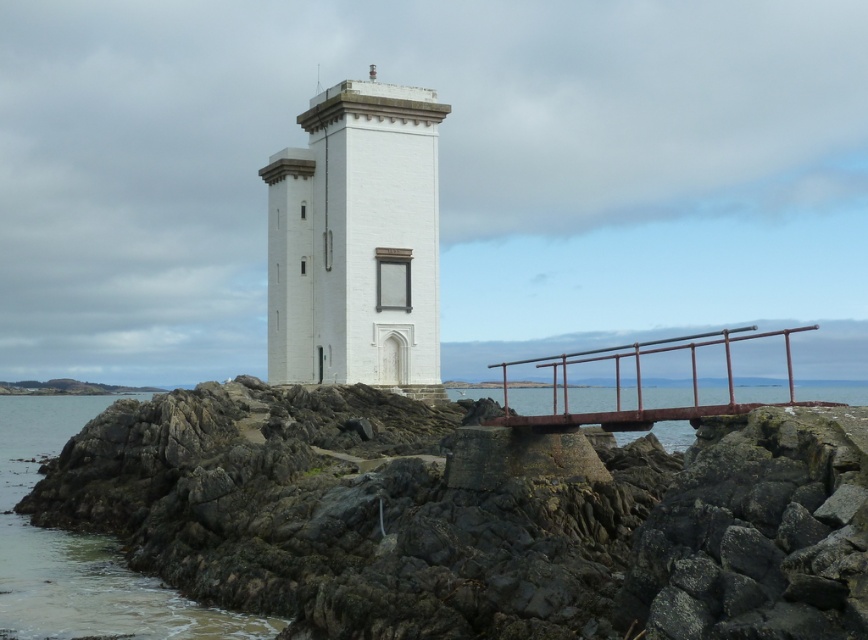
Question: Which point is closer to the camera?

Choices:
 (A) (117, 593)
 (B) (323, 136)

Answer: (A)

Question: Is white matte tower at center positioned in front of rusty metal railing at center?

Choices:
 (A) yes
 (B) no

Answer: (B)

Question: Among these objects, which one is farthest from the camera?

Choices:
 (A) white matte tower at center
 (B) rusty metal railing at center
 (C) clear water at lower left
 (D) rough stone rocks at center

Answer: (A)

Question: Can you confirm if white matte tower at center is positioned below clear water at lower left?

Choices:
 (A) no
 (B) yes

Answer: (A)

Question: Which object is positioned farthest from the clear water at lower left?

Choices:
 (A) white matte tower at center
 (B) rough stone rocks at center

Answer: (A)

Question: Can you confirm if white matte tower at center is smaller than clear water at lower left?

Choices:
 (A) yes
 (B) no

Answer: (A)